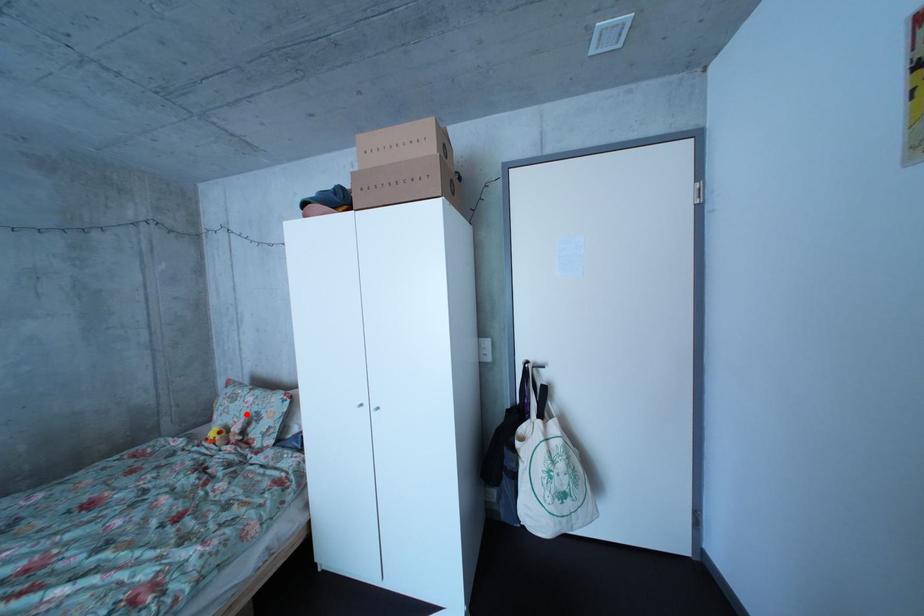
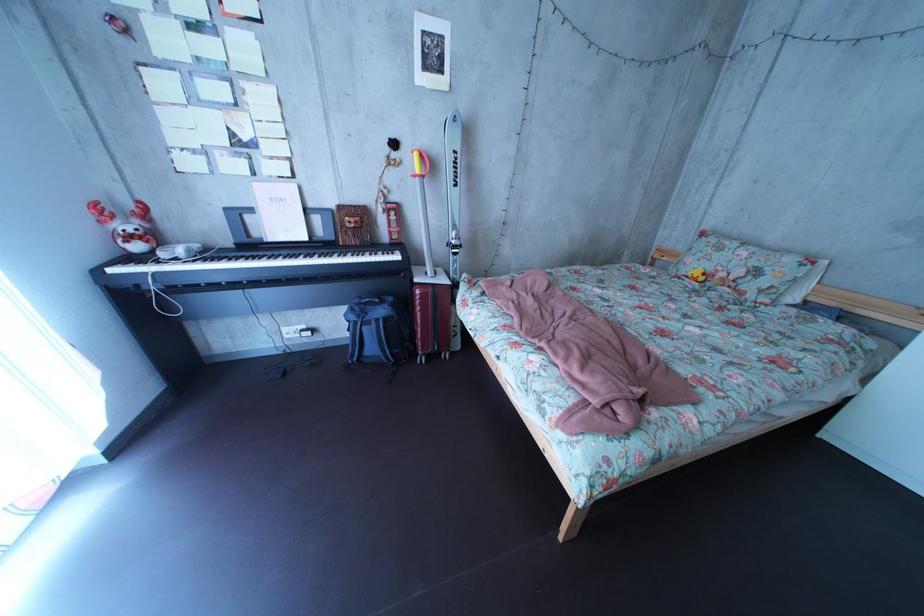
Question: A red point is marked in image1. In image2, is the corresponding 3D point closer to the camera or farther? Reply with the corresponding letter.

Choices:
 (A) The corresponding 3D point is closer.
 (B) The corresponding 3D point is farther.

Answer: (A)